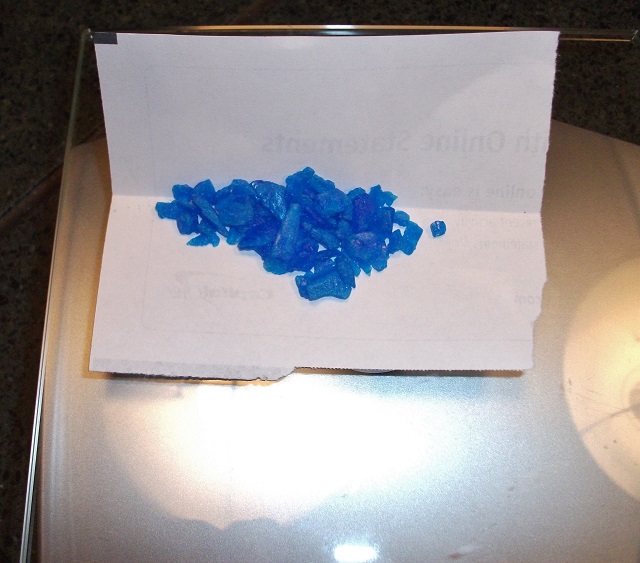
What are the coordinates of `light` in the screenshot? It's located at tap(243, 410), tap(353, 545), tap(601, 370).